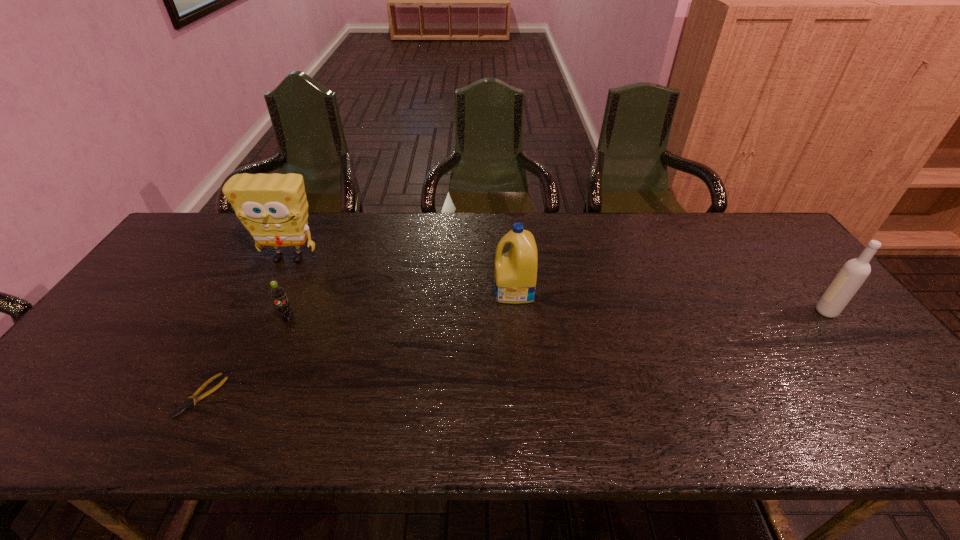
Where is `vacant space at the far left corner of the desktop`? This screenshot has width=960, height=540. vacant space at the far left corner of the desktop is located at coordinates (223, 242).

You are a GUI agent. You are given a task and a screenshot of the screen. Output one action in this format:
    pyautogui.click(x=<x>, y=<y>)
    Task: Click on the vacant space at the far right corner of the desktop
    The height and width of the screenshot is (540, 960).
    Given the screenshot: What is the action you would take?
    tap(772, 237)

Where is `vacant space in between the soda and the rightmost object`? The image size is (960, 540). vacant space in between the soda and the rightmost object is located at coordinates (557, 315).

In order to click on free space between the pliers and the rightmost object in this screenshot , I will do `click(514, 354)`.

Locate an element on the screen. Image resolution: width=960 pixels, height=540 pixels. vacant space in between the second shortest object and the farthest object is located at coordinates coord(289,289).

This screenshot has width=960, height=540. Identify the location of unoccupied position between the vodka and the detergent. (670, 301).

The width and height of the screenshot is (960, 540). In order to click on unoccupied area between the vodka and the detergent in this screenshot , I will do `click(670, 301)`.

Find the location of `free point between the second shortest object and the vodka`. free point between the second shortest object and the vodka is located at coordinates (557, 315).

I want to click on vacant space that is in between the farthest object and the detergent, so click(x=401, y=275).

Where is `empty location between the vodka and the farthest object`? This screenshot has width=960, height=540. empty location between the vodka and the farthest object is located at coordinates (558, 285).